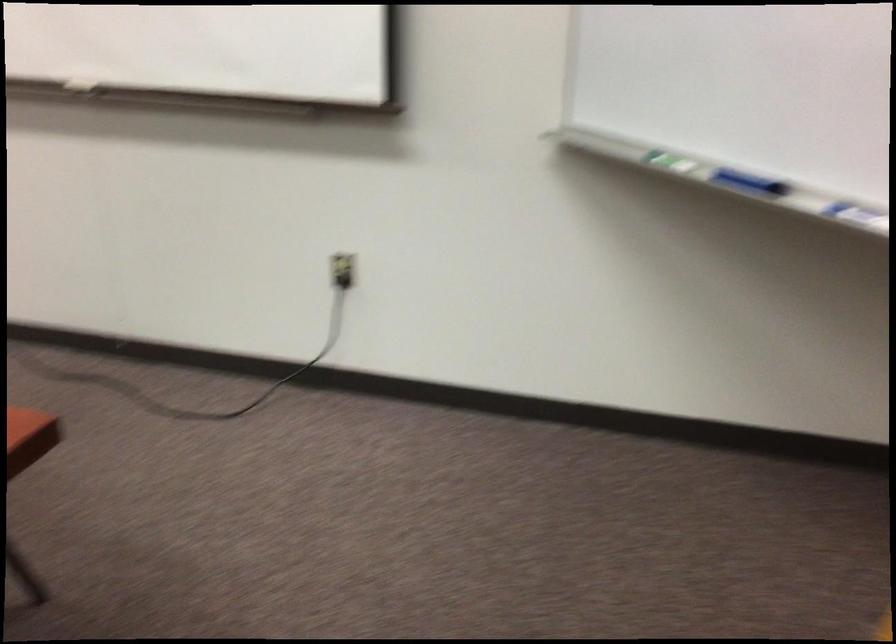
This screenshot has height=644, width=896. I want to click on black electrical plug, so click(341, 265).